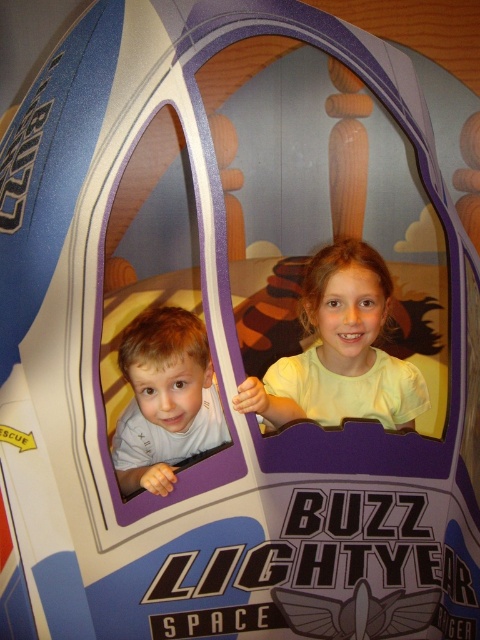
Question: In this image, where is light yellow shirt at center located relative to light brown hair at left?

Choices:
 (A) below
 (B) above

Answer: (B)

Question: Is light yellow shirt at center below light brown hair at left?

Choices:
 (A) yes
 (B) no

Answer: (B)

Question: Which object appears farthest from the camera in this image?

Choices:
 (A) light yellow shirt at center
 (B) light brown hair at left

Answer: (A)

Question: Which object appears farthest from the camera in this image?

Choices:
 (A) light brown hair at left
 (B) light yellow shirt at center

Answer: (B)

Question: Which of the following is the closest to the observer?

Choices:
 (A) (149, 486)
 (B) (356, 403)

Answer: (A)

Question: Does light yellow shirt at center appear under light brown hair at left?

Choices:
 (A) no
 (B) yes

Answer: (A)